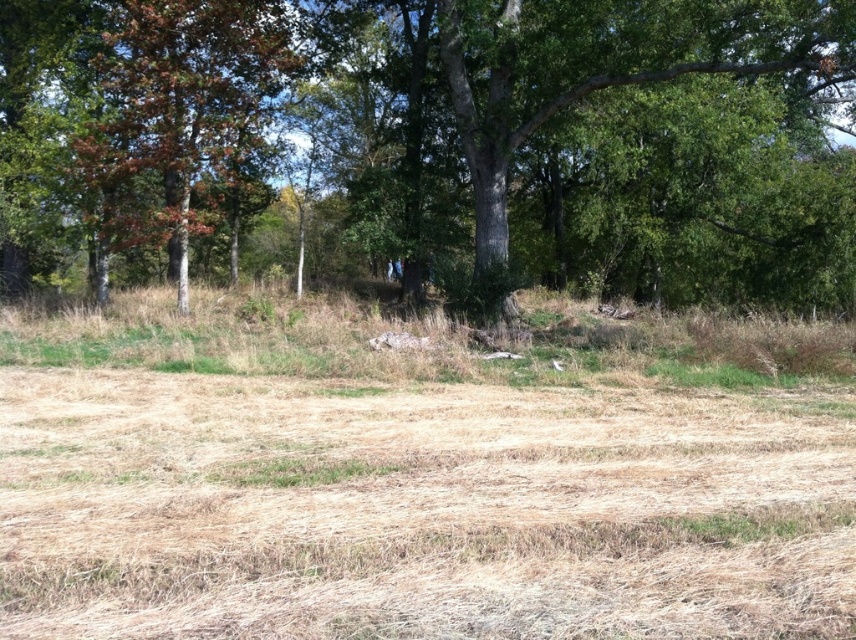
Question: Which of the following is the closest to the observer?

Choices:
 (A) green rough bark tree at upper center
 (B) orange-brown bark tree at left

Answer: (A)

Question: Can you confirm if green rough bark tree at upper center is positioned below orange-brown bark tree at left?

Choices:
 (A) yes
 (B) no

Answer: (A)

Question: Is green rough bark tree at upper center to the right of orange-brown bark tree at left from the viewer's perspective?

Choices:
 (A) no
 (B) yes

Answer: (B)

Question: Which point appears farthest from the camera in this image?

Choices:
 (A) (123, 42)
 (B) (88, 189)

Answer: (B)

Question: Is green rough bark tree at upper center positioned at the back of orange-brown bark tree at left?

Choices:
 (A) yes
 (B) no

Answer: (B)